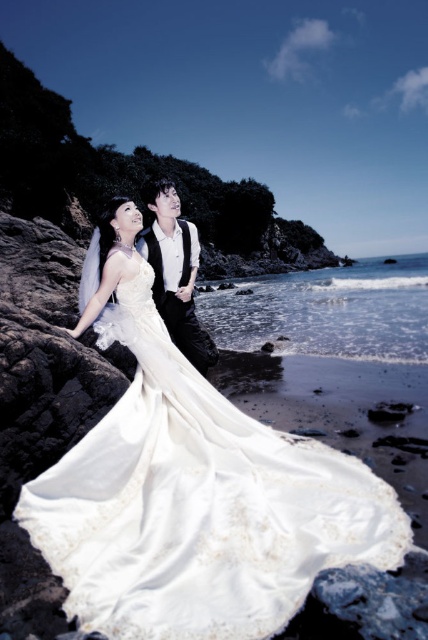
Which is more to the left, satin/sheen dress at center or black satin vest at center?

black satin vest at center is more to the left.

Who is positioned more to the right, satin/sheen dress at center or black satin vest at center?

From the viewer's perspective, satin/sheen dress at center appears more on the right side.

Measure the distance between satin/sheen dress at center and camera.

The distance of satin/sheen dress at center from camera is 7.14 feet.

At what (x,y) coordinates should I click in order to perform the action: click on satin/sheen dress at center. Please return your answer as a coordinate pair (x, y). Looking at the image, I should click on (196, 502).